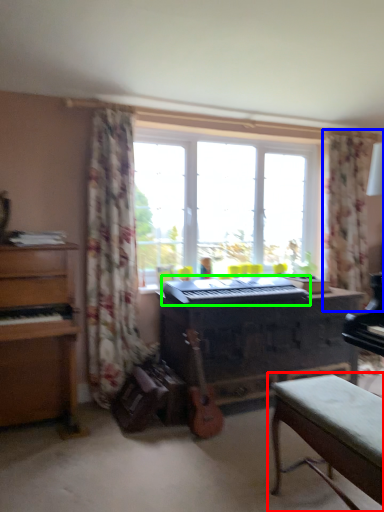
Question: Which is nearer to the table (highlighted by a red box)? curtain (highlighted by a blue box) or musical keyboard (highlighted by a green box).

Choices:
 (A) curtain
 (B) musical keyboard

Answer: (B)